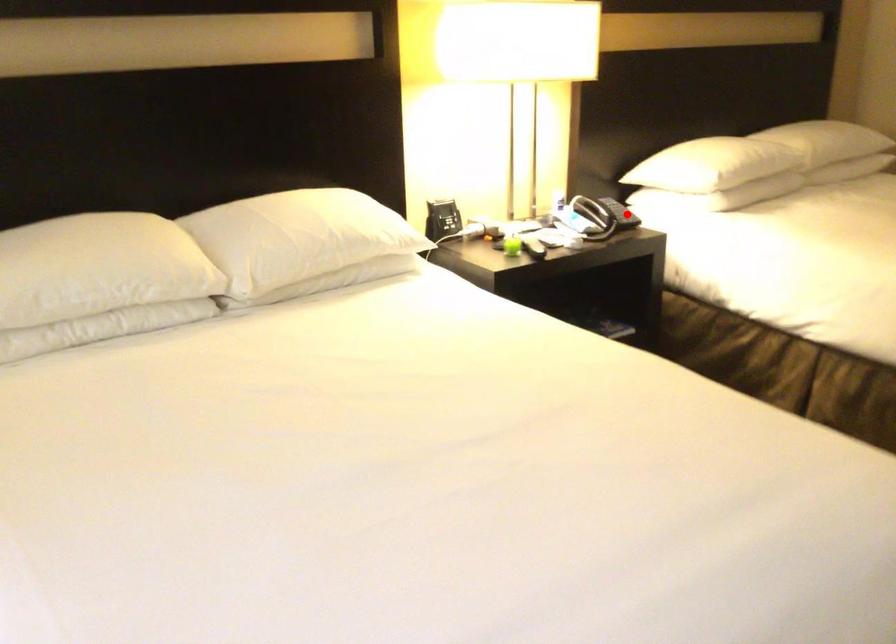
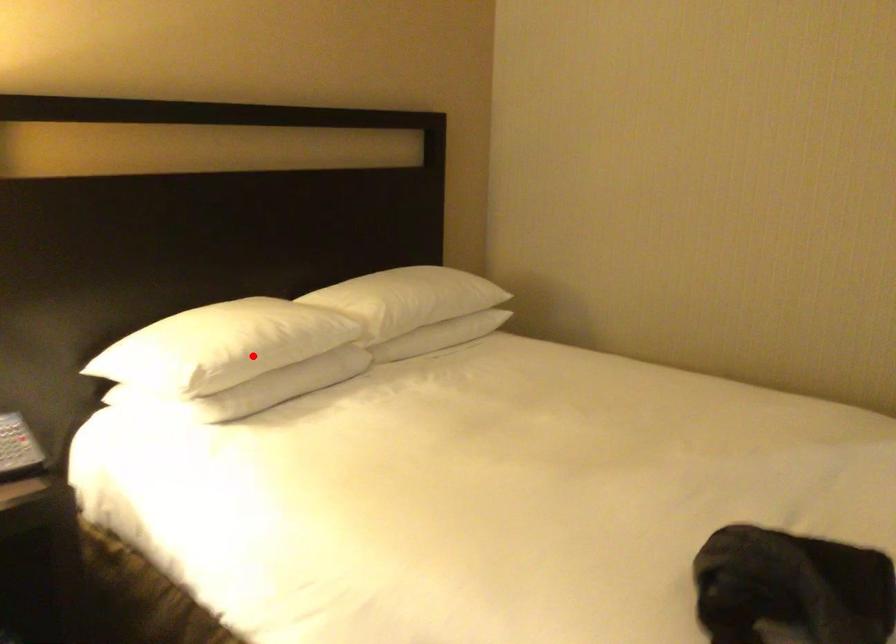
I am providing you with two images of the same scene from different viewpoints. A red point is marked on the first image and another point is marked on the second image. Is the red point in image1 aligned with the point shown in image2?

No